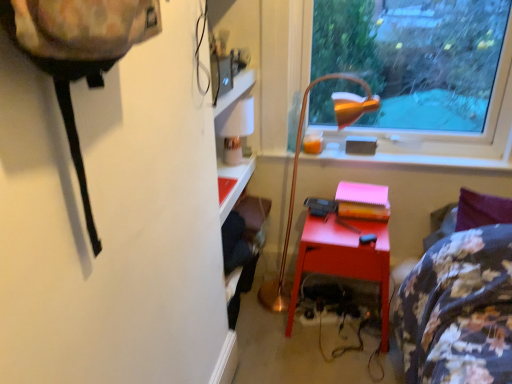
Locate an element on the screen. The image size is (512, 384). vacant space in transparent glass window at upper right (from a real-world perspective) is located at coordinates (402, 153).